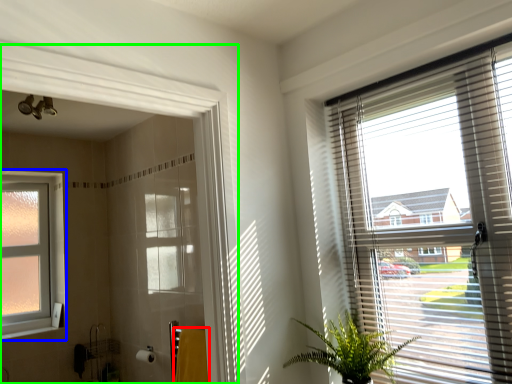
Question: Estimate the real-world distances between objects in this image. Which object is closer to bath towel (highlighted by a red box), window (highlighted by a blue box) or screen door (highlighted by a green box)?

Choices:
 (A) window
 (B) screen door

Answer: (B)